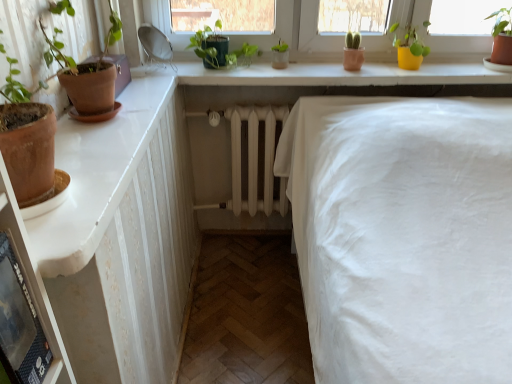
What do you see at coordinates (280, 59) in the screenshot?
I see `green matte flowerpot at center` at bounding box center [280, 59].

What do you see at coordinates (218, 48) in the screenshot? This screenshot has height=384, width=512. I see `green matte plant at upper center, acting as the 1th houseplant starting from the left` at bounding box center [218, 48].

Looking at this image, what is the approximate width of yellow matte pot at upper right, placed as the first houseplant when sorted from right to left?

yellow matte pot at upper right, placed as the first houseplant when sorted from right to left, is 21.42 centimeters in width.

I want to click on terracotta clay pot at left, so click(x=120, y=71).

What is the approximate width of terracotta clay pot at left?

The width of terracotta clay pot at left is 5.69 inches.

Identify the location of green matte flowerpot at center. The image size is (512, 384). (280, 59).

Is white glossy dresser at left oriented towards black plastic shelf at lower left?

Yes, white glossy dresser at left is facing black plastic shelf at lower left.

Between white glossy dresser at left and black plastic shelf at lower left, which one has less height?

With less height is white glossy dresser at left.

Which is in front, point (178, 279) or point (17, 231)?

Point (17, 231)

How different are the orientations of terracotta clay pot at left and black plastic shelf at lower left in degrees?

The angular difference between terracotta clay pot at left and black plastic shelf at lower left is 5.99 degrees.

From a real-world perspective, is terracotta clay pot at left located higher than black plastic shelf at lower left?

Yes, from a real-world perspective, terracotta clay pot at left is on top of black plastic shelf at lower left.

Is terracotta clay pot at left inside the boundaries of black plastic shelf at lower left, or outside?

terracotta clay pot at left is not inside black plastic shelf at lower left, it's outside.

Is terracotta clay pot at left thinner than black plastic shelf at lower left?

No.

From the picture: Considering the sizes of objects yellow matte pot at upper right, placed as the first houseplant when sorted from right to left, and black plastic shelf at lower left in the image provided, who is wider, yellow matte pot at upper right, placed as the first houseplant when sorted from right to left, or black plastic shelf at lower left?

yellow matte pot at upper right, placed as the first houseplant when sorted from right to left.

Considering the sizes of objects yellow matte pot at upper right, placed as the first houseplant when sorted from right to left, and black plastic shelf at lower left in the image provided, who is bigger, yellow matte pot at upper right, placed as the first houseplant when sorted from right to left, or black plastic shelf at lower left?

Bigger between the two is yellow matte pot at upper right, placed as the first houseplant when sorted from right to left.

From the image's perspective, which object appears higher, yellow matte pot at upper right, placed as the first houseplant when sorted from right to left, or black plastic shelf at lower left?

yellow matte pot at upper right, placed as the first houseplant when sorted from right to left.

Which of these two, yellow matte pot at upper right, positioned as the 2th houseplant in left-to-right order, or black plastic shelf at lower left, stands taller?

black plastic shelf at lower left.

Is green matte flowerpot at center looking in the opposite direction of white glossy dresser at left?

green matte flowerpot at center does not have its back to white glossy dresser at left.

From the image's perspective, is green matte flowerpot at center below white glossy dresser at left?

No, from the image's perspective, green matte flowerpot at center is not beneath white glossy dresser at left.

At what (x,y) coordinates should I click in order to perform the action: click on dresser in front of the green matte flowerpot at center. Please return your answer as a coordinate pair (x, y). Looking at the image, I should click on (122, 237).

Based on the photo, considering the relative sizes of green matte flowerpot at center and white glossy dresser at left in the image provided, is green matte flowerpot at center wider than white glossy dresser at left?

In fact, green matte flowerpot at center might be narrower than white glossy dresser at left.

Who is taller, black plastic shelf at lower left or yellow matte pot at upper right, placed as the first houseplant when sorted from right to left?

black plastic shelf at lower left.

What's the angular difference between black plastic shelf at lower left and yellow matte pot at upper right, placed as the first houseplant when sorted from right to left,'s facing directions?

The angular difference between black plastic shelf at lower left and yellow matte pot at upper right, placed as the first houseplant when sorted from right to left, is 85 degrees.

Could you measure the distance between black plastic shelf at lower left and yellow matte pot at upper right, positioned as the 2th houseplant in left-to-right order?

black plastic shelf at lower left is 1.72 meters from yellow matte pot at upper right, positioned as the 2th houseplant in left-to-right order.

Which object is further away from the camera taking this photo, black plastic shelf at lower left or yellow matte pot at upper right, placed as the first houseplant when sorted from right to left?

yellow matte pot at upper right, placed as the first houseplant when sorted from right to left, is further from the camera.

This screenshot has width=512, height=384. What are the coordinates of `dresser on the left of green matte plant at upper center, which is the 2th houseplant from right to left` in the screenshot? It's located at (122, 237).

From a real-world perspective, is white glossy dresser at left on green matte plant at upper center, which is the 2th houseplant from right to left?

No, from a real-world perspective, white glossy dresser at left is not above green matte plant at upper center, which is the 2th houseplant from right to left.

From the image's perspective, is white glossy dresser at left below green matte plant at upper center, acting as the 1th houseplant starting from the left?

Indeed, from the image's perspective, white glossy dresser at left is shown beneath green matte plant at upper center, acting as the 1th houseplant starting from the left.

Considering the positions of objects white glossy dresser at left and green matte plant at upper center, acting as the 1th houseplant starting from the left, in the image provided, who is in front, white glossy dresser at left or green matte plant at upper center, acting as the 1th houseplant starting from the left,?

white glossy dresser at left is more forward.

Is terracotta clay pot at left looking in the opposite direction of white glossy dresser at left?

No, terracotta clay pot at left is not facing the opposite direction of white glossy dresser at left.

What's the angular difference between terracotta clay pot at left and white glossy dresser at left's facing directions?

The facing directions of terracotta clay pot at left and white glossy dresser at left are 89.3 degrees apart.

Which point is more distant from viewer, (119, 88) or (106, 361)?

The point (119, 88) is behind.

Is terracotta clay pot at left next to white glossy dresser at left?

terracotta clay pot at left and white glossy dresser at left are not in contact.

Locate an element on the screen. The width and height of the screenshot is (512, 384). shelf located underneath the white glossy dresser at left (from a real-world perspective) is located at coordinates (34, 281).

I want to click on window box located on the left of black plastic shelf at lower left, so click(x=120, y=71).

Considering their positions, is white glossy dresser at left positioned further to yellow matte pot at upper right, placed as the first houseplant when sorted from right to left, than green matte flowerpot at center?

Among the two, white glossy dresser at left is located further to yellow matte pot at upper right, placed as the first houseplant when sorted from right to left.

Which object lies nearer to the anchor point green matte plant at upper center, acting as the 1th houseplant starting from the left, yellow matte pot at upper right, positioned as the 2th houseplant in left-to-right order, or white glossy dresser at left?

Among the two, yellow matte pot at upper right, positioned as the 2th houseplant in left-to-right order, is located nearer to green matte plant at upper center, acting as the 1th houseplant starting from the left.

Which object lies further to the anchor point white glossy dresser at left, green matte flowerpot at center or black plastic shelf at lower left?

Based on the image, green matte flowerpot at center appears to be further to white glossy dresser at left.

When comparing their distances from yellow matte pot at upper right, positioned as the 2th houseplant in left-to-right order, does green matte flowerpot at center or green matte plant at upper center, acting as the 1th houseplant starting from the left, seem closer?

Based on the image, green matte flowerpot at center appears to be nearer to yellow matte pot at upper right, positioned as the 2th houseplant in left-to-right order.

Considering their positions, is white glossy dresser at left positioned closer to yellow matte pot at upper right, placed as the first houseplant when sorted from right to left, than green matte plant at upper center, acting as the 1th houseplant starting from the left?

The object closer to yellow matte pot at upper right, placed as the first houseplant when sorted from right to left, is green matte plant at upper center, acting as the 1th houseplant starting from the left.

From the image, which object appears to be nearer to terracotta clay pot at left, yellow matte pot at upper right, placed as the first houseplant when sorted from right to left, or green matte plant at upper center, acting as the 1th houseplant starting from the left?

green matte plant at upper center, acting as the 1th houseplant starting from the left, is positioned closer to the anchor terracotta clay pot at left.

From the image, which object appears to be nearer to yellow matte pot at upper right, positioned as the 2th houseplant in left-to-right order, white glossy dresser at left or black plastic shelf at lower left?

white glossy dresser at left.

From the image, which object appears to be farther from white glossy dresser at left, yellow matte pot at upper right, placed as the first houseplant when sorted from right to left, or terracotta clay pot at left?

The object further to white glossy dresser at left is yellow matte pot at upper right, placed as the first houseplant when sorted from right to left.

The image size is (512, 384). Identify the location of dresser between black plastic shelf at lower left and green matte flowerpot at center from front to back. (122, 237).

Identify the location of window box between white glossy dresser at left and green matte flowerpot at center along the z-axis. (120, 71).

Find the location of a particular element. This screenshot has width=512, height=384. houseplant between black plastic shelf at lower left and yellow matte pot at upper right, positioned as the 2th houseplant in left-to-right order, from front to back is located at coordinates (218, 48).

Identify the location of houseplant between terracotta clay pot at left and green matte flowerpot at center. The width and height of the screenshot is (512, 384). (x=218, y=48).